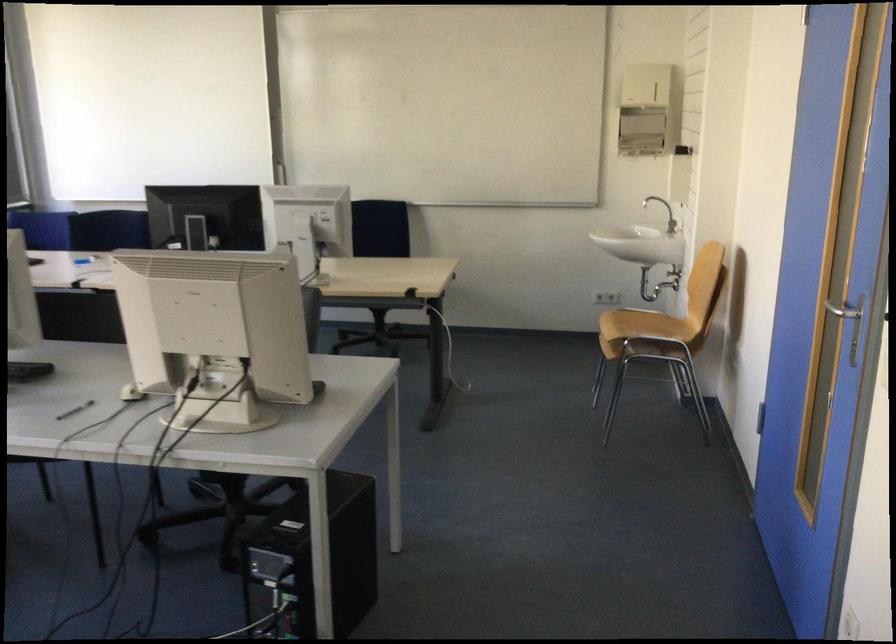
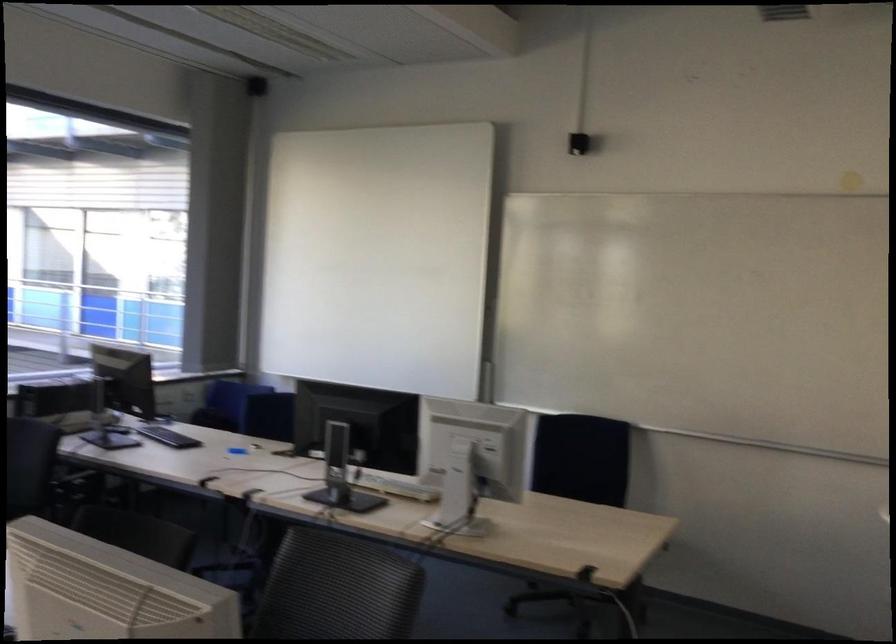
Question: Based on the continuous images, in which direction is the camera rotating? Reply with the corresponding letter.

Choices:
 (A) Left
 (B) Right
 (C) Up
 (D) Down

Answer: (A)